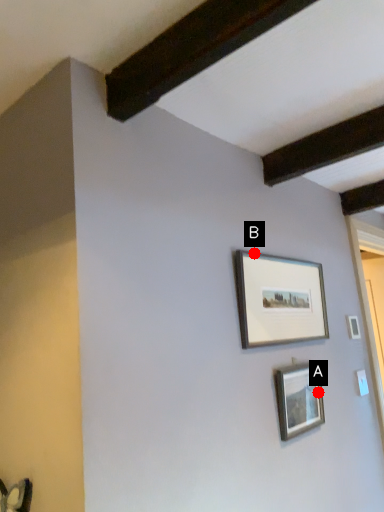
Question: Two points are circled on the image, labeled by A and B beside each circle. Among these points, which one is nearest to the camera?

Choices:
 (A) A is closer
 (B) B is closer

Answer: (B)